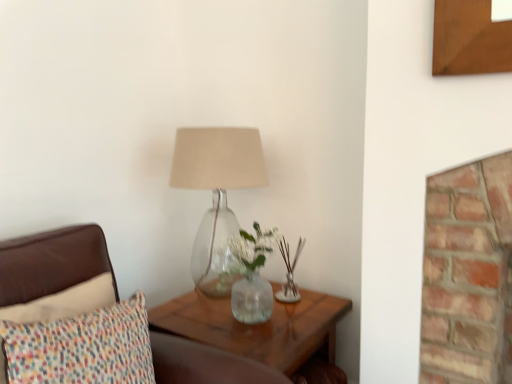
The width and height of the screenshot is (512, 384). What do you see at coordinates (216, 193) in the screenshot?
I see `translucent glass lamp at center` at bounding box center [216, 193].

At what (x,y) coordinates should I click in order to perform the action: click on translucent glass lamp at center. Please return your answer as a coordinate pair (x, y). This screenshot has height=384, width=512. Looking at the image, I should click on point(216,193).

From the image's perspective, is multicolored fabric pillow at left located above or below translucent wood table at lower right?

Based on their image positions, multicolored fabric pillow at left is located above translucent wood table at lower right.

Based on the photo, considering the sizes of objects multicolored fabric pillow at left and translucent wood table at lower right in the image provided, who is taller, multicolored fabric pillow at left or translucent wood table at lower right?

translucent wood table at lower right.

Considering the sizes of multicolored fabric pillow at left and translucent wood table at lower right in the image, is multicolored fabric pillow at left wider or thinner than translucent wood table at lower right?

Clearly, multicolored fabric pillow at left has less width compared to translucent wood table at lower right.

Is multicolored fabric pillow at left with translucent wood table at lower right?

multicolored fabric pillow at left and translucent wood table at lower right are not in contact.

Is multicolored fabric pillow at left at the back of translucent wood table at lower right?

No, translucent wood table at lower right is not facing the opposite direction of multicolored fabric pillow at left.

Is translucent wood table at lower right in front of multicolored fabric pillow at left?

No, it is behind multicolored fabric pillow at left.

Which point is more distant from viewer, (183,322) or (56,363)?

Positioned behind is point (183,322).

Is translucent glass lamp at center not near translucent wood table at lower right?

No, translucent glass lamp at center is not far away from translucent wood table at lower right.

Is translucent glass lamp at center completely or partially outside of translucent wood table at lower right?

Yes.

Is the depth of translucent glass lamp at center greater than that of translucent wood table at lower right?

Yes.

Which object is thinner, translucent glass lamp at center or translucent wood table at lower right?

translucent glass lamp at center.

Which point is more forward, (317, 327) or (226, 235)?

The point (317, 327) is more forward.

From a real-world perspective, is translucent wood table at lower right below translucent glass lamp at center?

Yes, from a real-world perspective, translucent wood table at lower right is beneath translucent glass lamp at center.

From the image's perspective, is translucent wood table at lower right beneath translucent glass lamp at center?

Yes, from the image's perspective, translucent wood table at lower right is beneath translucent glass lamp at center.

Is translucent wood table at lower right surrounding translucent glass lamp at center?

No, translucent wood table at lower right does not contain translucent glass lamp at center.

Based on their sizes in the image, would you say translucent glass lamp at center is bigger or smaller than multicolored fabric pillow at left?

Clearly, translucent glass lamp at center is larger in size than multicolored fabric pillow at left.

From the picture: Does translucent glass lamp at center touch multicolored fabric pillow at left?

No, translucent glass lamp at center is not next to multicolored fabric pillow at left.

From the picture: Could you tell me if translucent glass lamp at center is facing multicolored fabric pillow at left?

No.

Is translucent glass lamp at center to the right of multicolored fabric pillow at left from the viewer's perspective?

Indeed, translucent glass lamp at center is positioned on the right side of multicolored fabric pillow at left.

Considering the positions of objects multicolored fabric pillow at left and translucent glass lamp at center in the image provided, who is behind, multicolored fabric pillow at left or translucent glass lamp at center?

translucent glass lamp at center is more distant.

Considering the sizes of multicolored fabric pillow at left and translucent glass lamp at center in the image, is multicolored fabric pillow at left taller or shorter than translucent glass lamp at center?

In the image, multicolored fabric pillow at left appears to be shorter than translucent glass lamp at center.

Is multicolored fabric pillow at left bigger or smaller than translucent glass lamp at center?

In the image, multicolored fabric pillow at left appears to be smaller than translucent glass lamp at center.

From a real-world perspective, between multicolored fabric pillow at left and translucent glass lamp at center, who is vertically higher?

translucent glass lamp at center, from a real-world perspective.

I want to click on furniture above the translucent wood table at lower right (from a real-world perspective), so click(93, 322).

This screenshot has height=384, width=512. I want to click on table behind the multicolored fabric pillow at left, so click(x=258, y=327).

From the image, which object appears to be farther from translucent glass lamp at center, translucent wood table at lower right or multicolored fabric pillow at left?

multicolored fabric pillow at left lies further to translucent glass lamp at center than the other object.

Which object lies further to the anchor point translucent wood table at lower right, multicolored fabric pillow at left or translucent glass lamp at center?

Based on the image, multicolored fabric pillow at left appears to be further to translucent wood table at lower right.

Which object lies further to the anchor point translucent glass lamp at center, multicolored fabric pillow at left or translucent wood table at lower right?

Based on the image, multicolored fabric pillow at left appears to be further to translucent glass lamp at center.

Looking at the image, which one is located closer to multicolored fabric pillow at left, translucent wood table at lower right or translucent glass lamp at center?

translucent wood table at lower right is closer to multicolored fabric pillow at left.

Based on their spatial positions, is translucent glass lamp at center or translucent wood table at lower right further from multicolored fabric pillow at left?

The object further to multicolored fabric pillow at left is translucent glass lamp at center.

When comparing their distances from translucent wood table at lower right, does translucent glass lamp at center or multicolored fabric pillow at left seem closer?

translucent glass lamp at center.

Locate an element on the screen. This screenshot has width=512, height=384. table between multicolored fabric pillow at left and translucent glass lamp at center in the front-back direction is located at coordinates (258, 327).